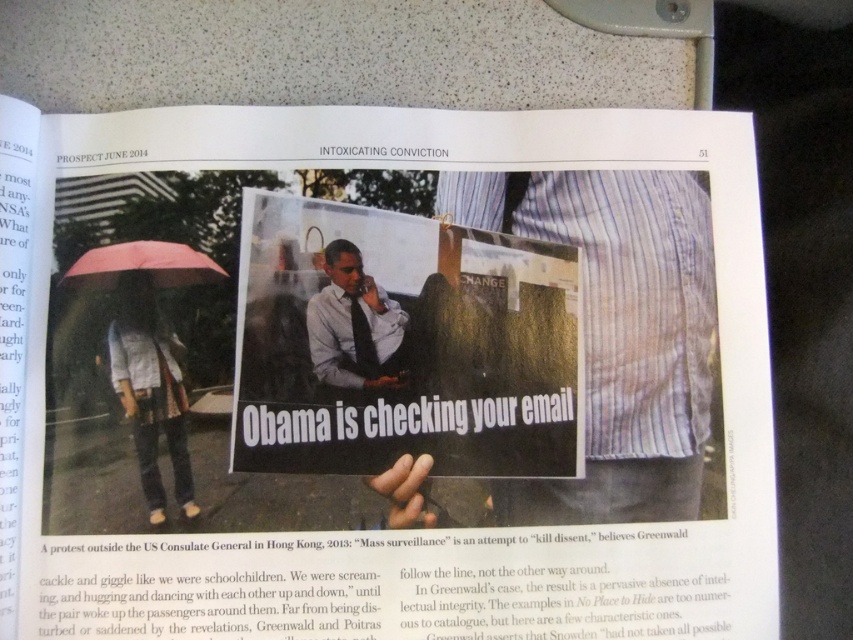
You are a graphic designer working on a layout for a magazine spread. You need to ensure that two elements, the white paper poster at center and the pink matte umbrella at upper left, are spaced appropriately for readability. Given that the minimum required spacing between elements for readability is 3 inches, does the current spacing meet the requirement?

The distance between the white paper poster at center and the pink matte umbrella at upper left is 3.84 inches, which exceeds the minimum required spacing of 3 inches. Therefore, the current spacing meets the readability requirement.

Consider the image. You are a photographer who wants to capture a closeup shot of the sign that says, Obama is checking your email. The sign is located at point (426,305). You are currently positioned 15.90 inches away from that point. Is this distance sufficient to capture the entire sign in your photo?

The distance between you and the sign at point (426,305) is 15.90 inches. This distance may be sufficient to capture the entire sign in your photo, but it depends on the camera lens and sensor size. However, since the question does not provide information about the camera equipment, we can only confirm the distance is 15.90 inches as stated.

You are a graphic designer reviewing the layout of this magazine page. You need to determine if the white paper poster at center will be visible above the pink matte umbrella at upper left. Based on their sizes, can you confirm this?

The white paper poster at center has a greater height compared to the pink matte umbrella at upper left, so yes, the white paper poster at center will be visible above the pink matte umbrella at upper left.